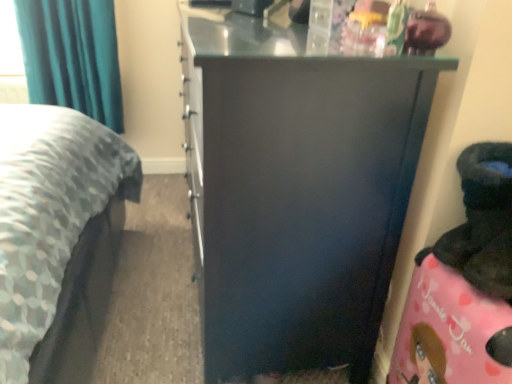
Where is `teal fabric curtain at upper left`? The image size is (512, 384). teal fabric curtain at upper left is located at coordinates (72, 56).

The image size is (512, 384). Describe the element at coordinates (72, 56) in the screenshot. I see `teal fabric curtain at upper left` at that location.

I want to click on matte black cabinet at center, so click(296, 190).

This screenshot has height=384, width=512. What do you see at coordinates (296, 190) in the screenshot? I see `matte black cabinet at center` at bounding box center [296, 190].

What is the approximate height of matte black cabinet at center?

It is 38.03 inches.

In order to face matte black cabinet at center, should I rotate leftwards or rightwards?

It's best to rotate left around 0.148 degrees.

Find the location of a particular element. teal fabric curtain at upper left is located at coordinates (72, 56).

Would you say matte black cabinet at center is to the left or to the right of teal fabric curtain at upper left in the picture?

From the image, it's evident that matte black cabinet at center is to the right of teal fabric curtain at upper left.

Who is more distant, matte black cabinet at center or teal fabric curtain at upper left?

teal fabric curtain at upper left is more distant.

Considering the points (355, 59) and (37, 98), which point is in front, point (355, 59) or point (37, 98)?

The point (355, 59) is more forward.

From the image's perspective, is matte black cabinet at center located above teal fabric curtain at upper left?

No.

From a real-world perspective, is matte black cabinet at center located higher than teal fabric curtain at upper left?

Incorrect, from a real-world perspective, matte black cabinet at center is lower than teal fabric curtain at upper left.

Can you confirm if matte black cabinet at center is wider than teal fabric curtain at upper left?

Yes, matte black cabinet at center is wider than teal fabric curtain at upper left.

Who is taller, matte black cabinet at center or teal fabric curtain at upper left?

With more height is matte black cabinet at center.

Is matte black cabinet at center smaller than teal fabric curtain at upper left?

No, matte black cabinet at center is not smaller than teal fabric curtain at upper left.

Can we say matte black cabinet at center lies outside teal fabric curtain at upper left?

Indeed, matte black cabinet at center is completely outside teal fabric curtain at upper left.

Is there a large distance between matte black cabinet at center and teal fabric curtain at upper left?

Yes, matte black cabinet at center and teal fabric curtain at upper left are located far from each other.

Is teal fabric curtain at upper left at the back of matte black cabinet at center?

No.

At what (x,y) coordinates should I click in order to perform the action: click on furniture in front of the teal fabric curtain at upper left. Please return your answer as a coordinate pair (x, y). Looking at the image, I should click on (296, 190).

Can you confirm if teal fabric curtain at upper left is positioned to the left of matte black cabinet at center?

Yes.

Which object is closer to the camera, teal fabric curtain at upper left or matte black cabinet at center?

matte black cabinet at center.

Which is closer to the camera, (15,7) or (411,144)?

Point (15,7).

From the image's perspective, is teal fabric curtain at upper left on top of matte black cabinet at center?

Yes, from the image's perspective, teal fabric curtain at upper left is over matte black cabinet at center.

From a real-world perspective, who is located lower, teal fabric curtain at upper left or matte black cabinet at center?

In real-world perspective, matte black cabinet at center is lower.

Between teal fabric curtain at upper left and matte black cabinet at center, which one has smaller width?

With smaller width is teal fabric curtain at upper left.

Considering the sizes of objects teal fabric curtain at upper left and matte black cabinet at center in the image provided, who is shorter, teal fabric curtain at upper left or matte black cabinet at center?

teal fabric curtain at upper left is shorter.

Which of these two, teal fabric curtain at upper left or matte black cabinet at center, is bigger?

Bigger between the two is matte black cabinet at center.

In the scene shown: Can we say teal fabric curtain at upper left lies outside matte black cabinet at center?

Yes.

Is teal fabric curtain at upper left positioned far away from matte black cabinet at center?

teal fabric curtain at upper left is positioned a significant distance from matte black cabinet at center.

Does teal fabric curtain at upper left turn towards matte black cabinet at center?

No.

How different are the orientations of teal fabric curtain at upper left and matte black cabinet at center in degrees?

The angular difference between teal fabric curtain at upper left and matte black cabinet at center is 88.5 degrees.

At what (x,y) coordinates should I click in order to perform the action: click on curtain that appears above the matte black cabinet at center (from the image's perspective). Please return your answer as a coordinate pair (x, y). This screenshot has width=512, height=384. Looking at the image, I should click on (72, 56).

The width and height of the screenshot is (512, 384). In order to click on furniture beneath the teal fabric curtain at upper left (from a real-world perspective) in this screenshot , I will do `click(296, 190)`.

I want to click on furniture below the teal fabric curtain at upper left (from the image's perspective), so click(x=296, y=190).